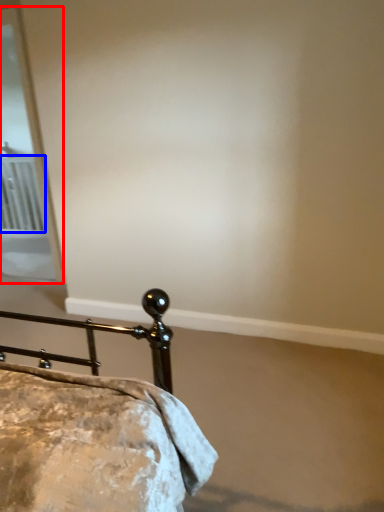
Question: Which of the following is the farthest to the observer, screen door (highlighted by a red box) or radiator (highlighted by a blue box)?

Choices:
 (A) screen door
 (B) radiator

Answer: (B)